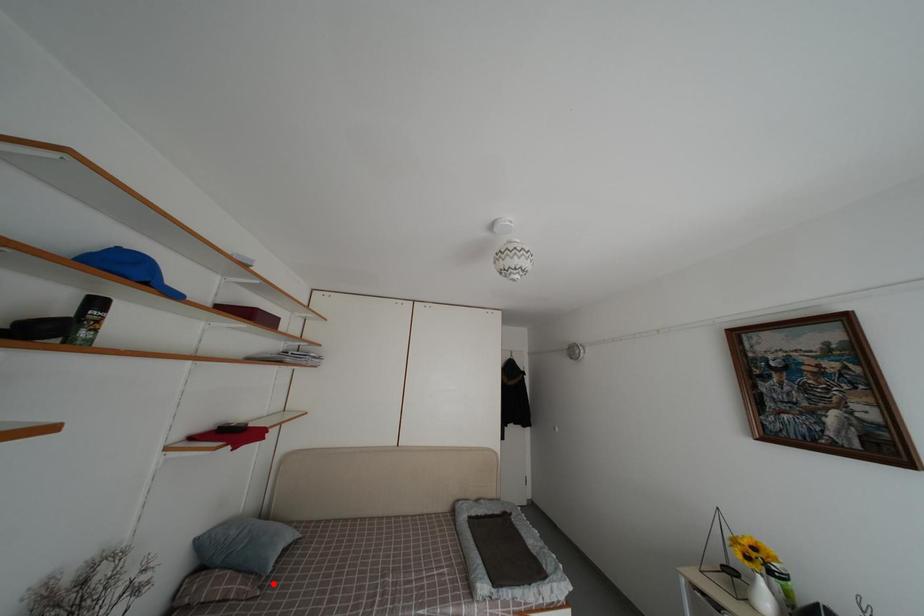
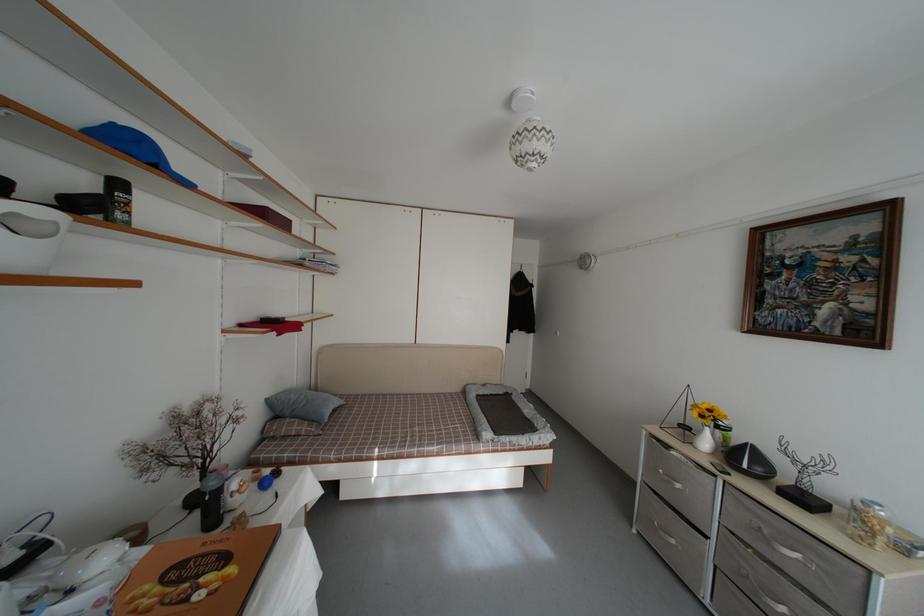
Question: I am providing you with two images of the same scene from different viewpoints. A red point is marked on the first image. Can you still see the location of the red point in image 2?

Choices:
 (A) Yes
 (B) No

Answer: (A)